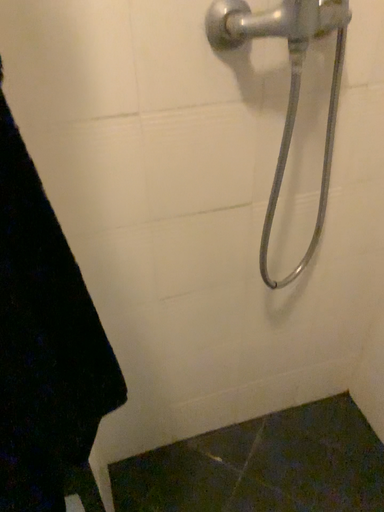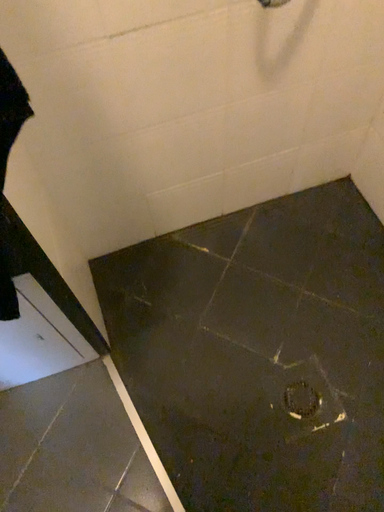
Question: Which way did the camera rotate in the video?

Choices:
 (A) rotated downward
 (B) rotated upward

Answer: (A)